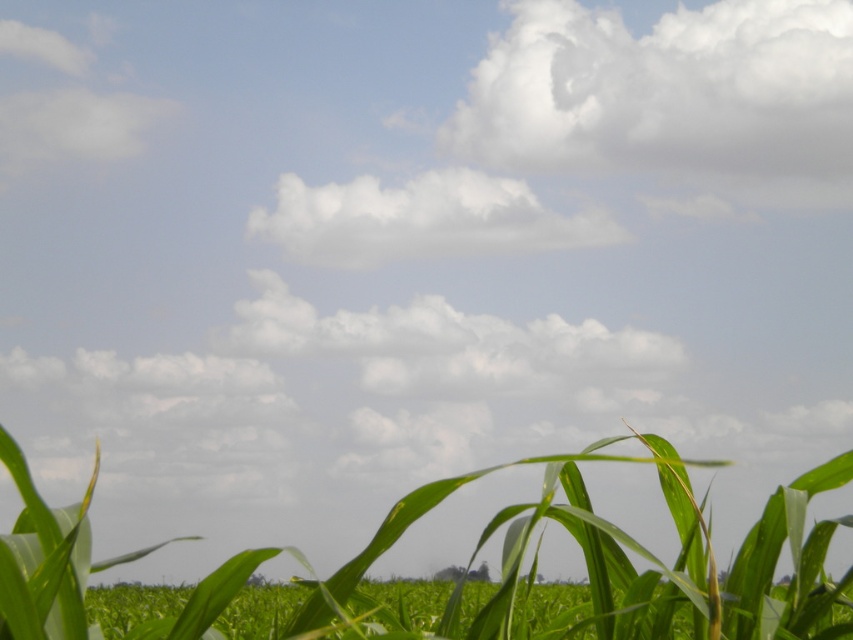
Question: Which of the following is the closest to the observer?

Choices:
 (A) white fluffy cloud at center
 (B) white fluffy cloud at upper center
 (C) green leafy corn at center

Answer: (C)

Question: Does white fluffy cloud at upper center appear on the right side of white fluffy cloud at center?

Choices:
 (A) no
 (B) yes

Answer: (B)

Question: Does green leafy corn at center have a lesser width compared to white fluffy cloud at upper center?

Choices:
 (A) yes
 (B) no

Answer: (A)

Question: Which object is closer to the camera taking this photo?

Choices:
 (A) white fluffy cloud at upper center
 (B) white fluffy cloud at center
 (C) green leafy corn at center

Answer: (C)

Question: Does white fluffy cloud at upper center appear under white fluffy cloud at center?

Choices:
 (A) no
 (B) yes

Answer: (A)

Question: Which object is positioned closest to the green leafy corn at center?

Choices:
 (A) white fluffy cloud at upper center
 (B) white fluffy cloud at center

Answer: (B)